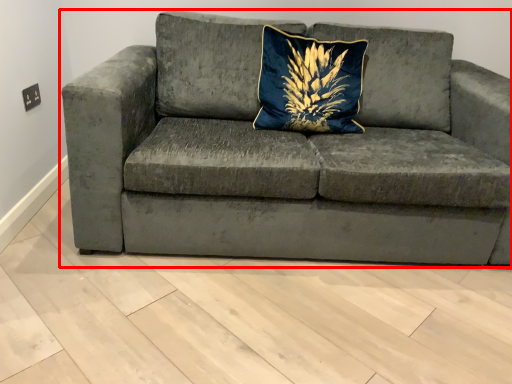
Question: From the image's perspective, where is studio couch (annotated by the red box) located in relation to pillow in the image?

Choices:
 (A) above
 (B) below

Answer: (B)